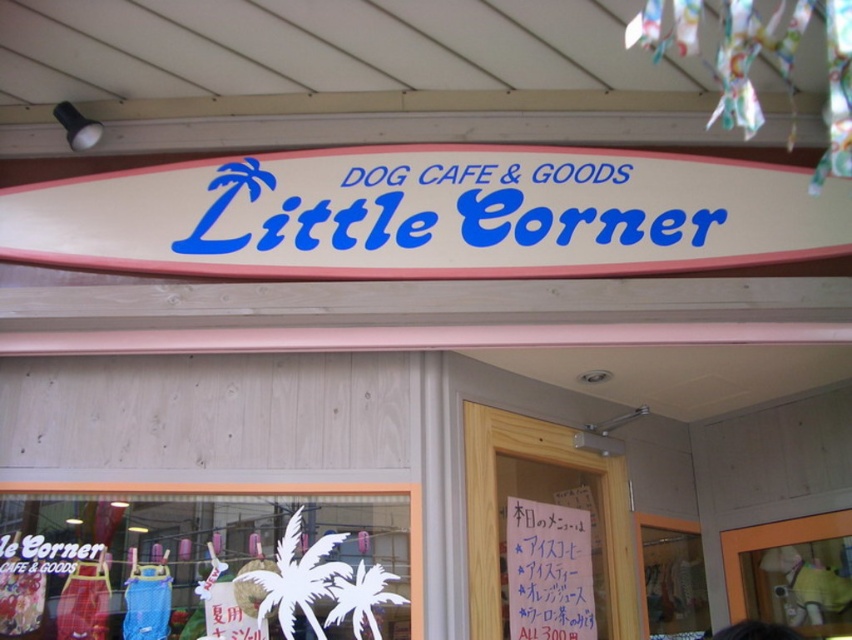
Looking at this image, can you confirm if white matte surfboard at center is thinner than white paper at center?

No, white matte surfboard at center is not thinner than white paper at center.

Is point (387, 156) closer to viewer compared to point (554, 525)?

Yes, it is in front of point (554, 525).

Does point (724, 227) lie behind point (521, 595)?

No, (724, 227) is in front of (521, 595).

At what (x,y) coordinates should I click in order to perform the action: click on white matte surfboard at center. Please return your answer as a coordinate pair (x, y). Looking at the image, I should click on (419, 212).